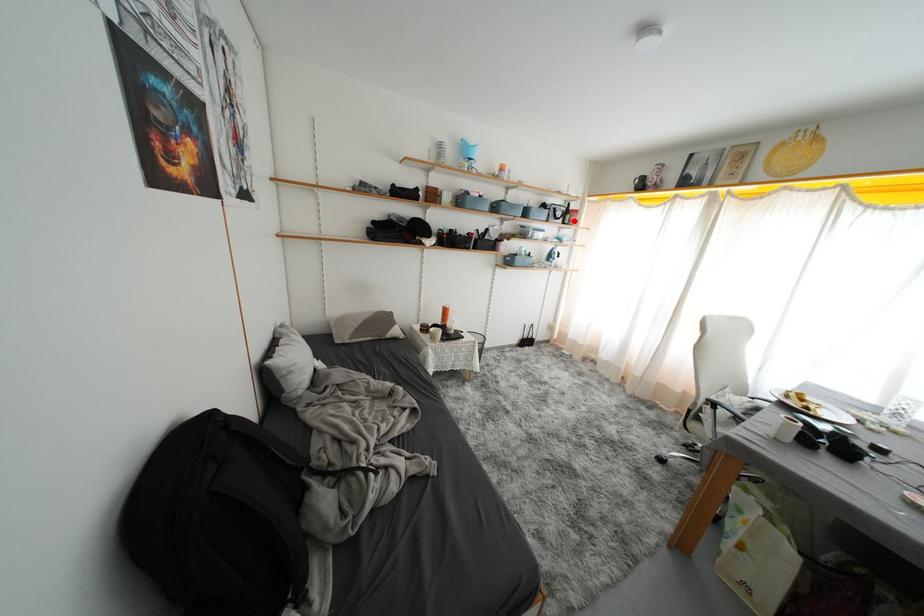
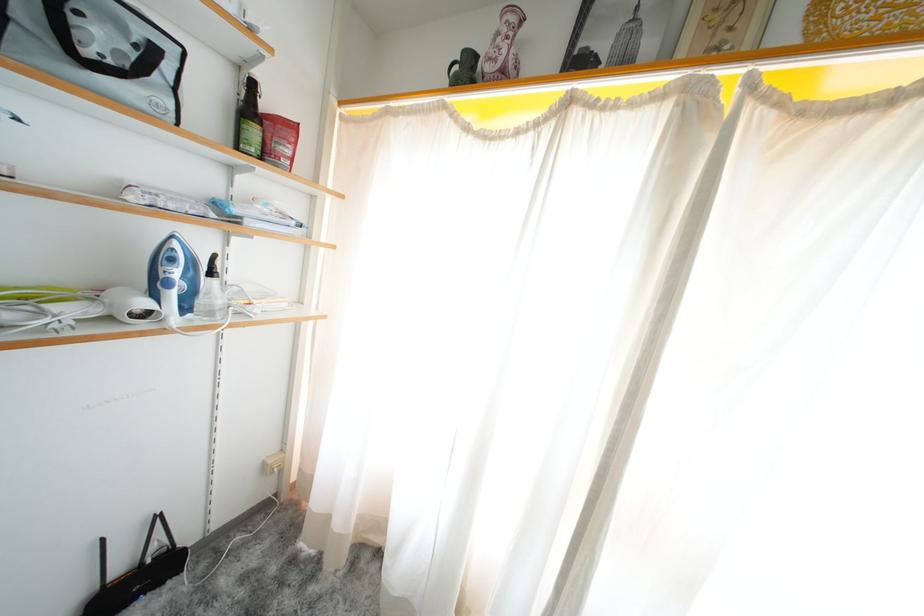
Question: I am providing you with two images of the same scene from different viewpoints. Given a red point in image1, look at the same physical point in image2. Is it:

Choices:
 (A) Closer to the viewpoint
 (B) Farther from the viewpoint

Answer: (B)